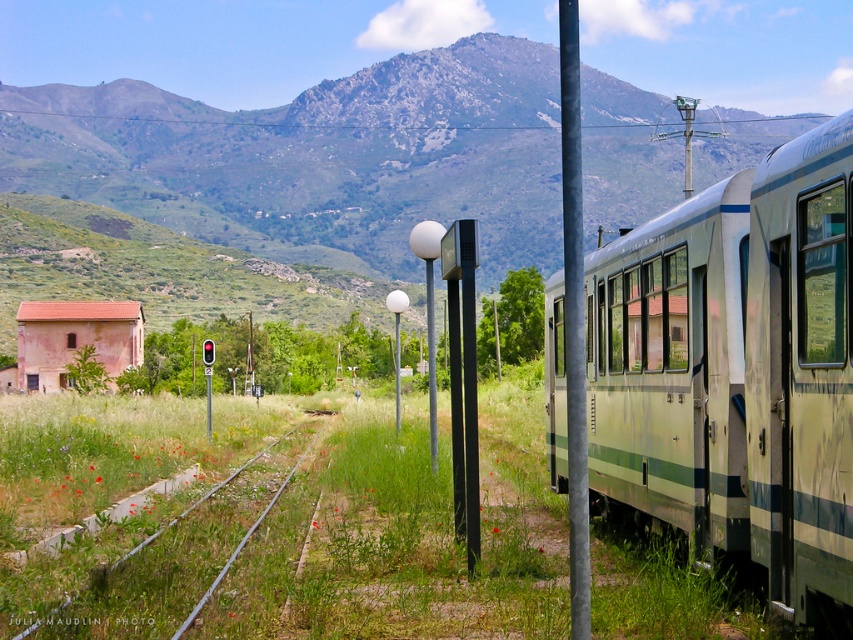
You are standing at the train station and want to walk from the train to the small weathered building with a reddish brown roof. The path you need to take goes through two specific points marked as point (x=572, y=128) and point (x=802, y=317). Which point should you step on first according to their positions?

You should step on point (x=572, y=128) first because it is closer to you than point (x=802, y=317).